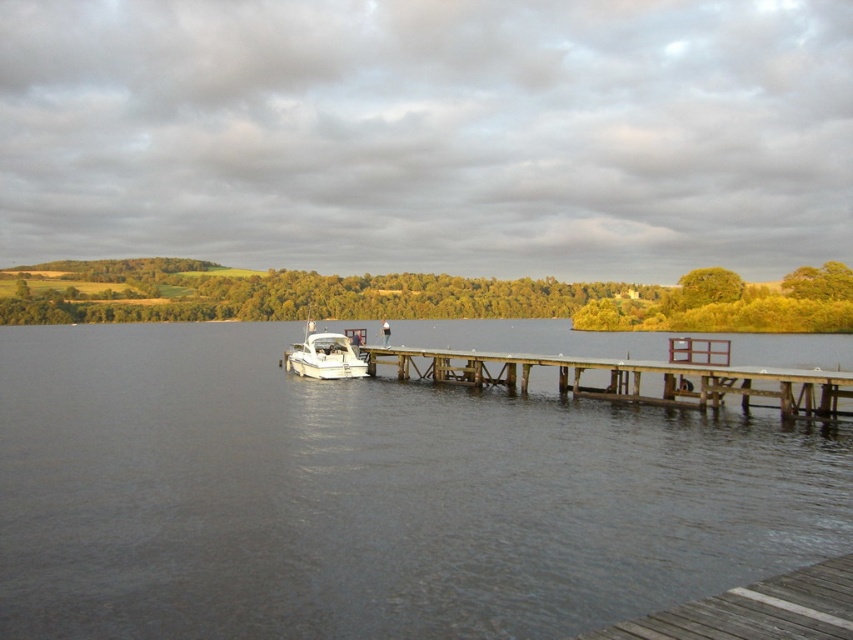
Does clear water at dock center lie in front of wooden dock at center?

Yes, clear water at dock center is closer to the viewer.

In the scene shown: Does clear water at dock center appear on the right side of wooden dock at center?

No, clear water at dock center is not to the right of wooden dock at center.

Which is in front, point (683, 467) or point (697, 371)?

Positioned in front is point (683, 467).

I want to click on clear water at dock center, so click(x=370, y=497).

Between clear water at dock center and white glossy boat at center, which one is positioned lower?

clear water at dock center

The width and height of the screenshot is (853, 640). Describe the element at coordinates (370, 497) in the screenshot. I see `clear water at dock center` at that location.

Who is more distant from viewer, (x=161, y=577) or (x=303, y=348)?

The point (x=303, y=348) is behind.

Locate an element on the screen. Image resolution: width=853 pixels, height=640 pixels. clear water at dock center is located at coordinates (370, 497).

Locate an element on the screen. Image resolution: width=853 pixels, height=640 pixels. wooden dock at center is located at coordinates (631, 380).

Between wooden dock at center and white glossy boat at center, which one is positioned lower?

wooden dock at center

Describe the element at coordinates (631, 380) in the screenshot. I see `wooden dock at center` at that location.

You are a GUI agent. You are given a task and a screenshot of the screen. Output one action in this format:
    pyautogui.click(x=<x>, y=<y>)
    Task: Click on the wooden dock at center
    
    Given the screenshot: What is the action you would take?
    pyautogui.click(x=631, y=380)